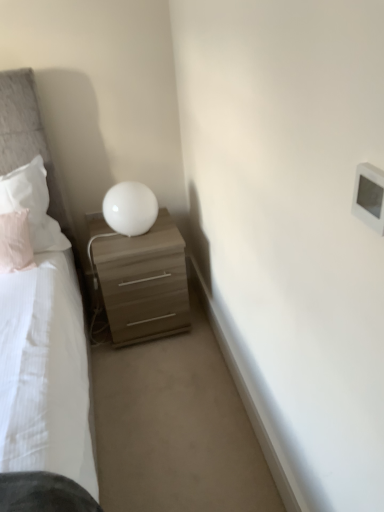
This screenshot has height=512, width=384. What are the coordinates of `vacant space to the right of white glossy sphere at upper right` in the screenshot? It's located at (166, 230).